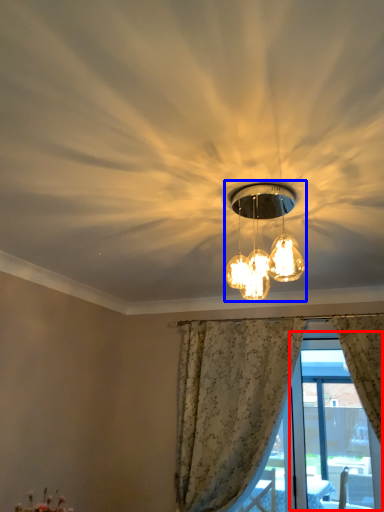
Question: Which object is closer to the camera taking this photo, window screen (highlighted by a red box) or lamp (highlighted by a blue box)?

Choices:
 (A) window screen
 (B) lamp

Answer: (B)